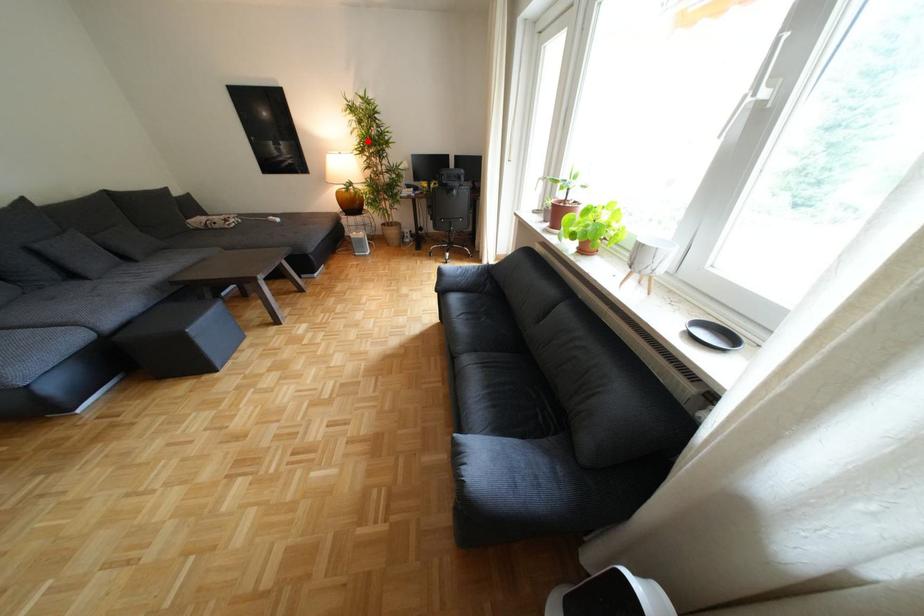
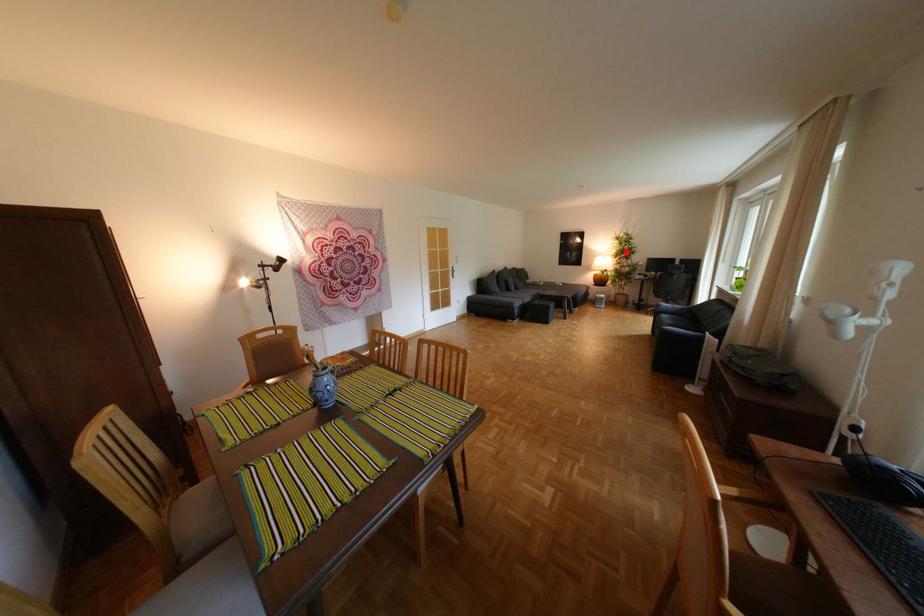
I am providing you with two images of the same scene from different viewpoints. A red point is marked on the first image and another point is marked on the second image. Do the highlighted points in image1 and image2 indicate the same real-world spot?

Yes